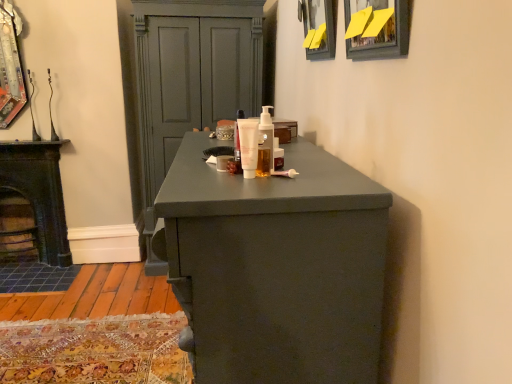
Question: Could you tell me if white matte tube at center, marked as the 2th mouthwash in a back-to-front arrangement, is facing matte black picture frame at upper center, arranged as the 2th picture frame when viewed from the front?

Choices:
 (A) no
 (B) yes

Answer: (A)

Question: From a real-world perspective, is white matte tube at center, the first mouthwash in the front-to-back sequence, physically below matte black picture frame at upper center, arranged as the 2th picture frame when viewed from the front?

Choices:
 (A) no
 (B) yes

Answer: (B)

Question: Is white matte tube at center, marked as the 2th mouthwash in a back-to-front arrangement, surrounding matte black picture frame at upper center, arranged as the 2th picture frame when viewed from the front?

Choices:
 (A) no
 (B) yes

Answer: (A)

Question: Is white matte tube at center, marked as the 2th mouthwash in a back-to-front arrangement, wider than matte black picture frame at upper center, which is the first picture frame from back to front?

Choices:
 (A) no
 (B) yes

Answer: (A)

Question: Considering the relative sizes of white matte tube at center, the first mouthwash in the front-to-back sequence, and matte black picture frame at upper center, which is the first picture frame from back to front, in the image provided, is white matte tube at center, the first mouthwash in the front-to-back sequence, smaller than matte black picture frame at upper center, which is the first picture frame from back to front,?

Choices:
 (A) no
 (B) yes

Answer: (B)

Question: From the image's perspective, is translucent plastic mouthwash at center, which ranks as the 1th mouthwash in back-to-front order, positioned above or below black cast iron stove at left?

Choices:
 (A) below
 (B) above

Answer: (B)

Question: Is translucent plastic mouthwash at center, which ranks as the 1th mouthwash in back-to-front order, wider or thinner than black cast iron stove at left?

Choices:
 (A) thin
 (B) wide

Answer: (A)

Question: Considering the positions of translucent plastic mouthwash at center, which ranks as the 1th mouthwash in back-to-front order, and black cast iron stove at left in the image, is translucent plastic mouthwash at center, which ranks as the 1th mouthwash in back-to-front order, taller or shorter than black cast iron stove at left?

Choices:
 (A) tall
 (B) short

Answer: (B)

Question: In terms of size, does translucent plastic mouthwash at center, which ranks as the 1th mouthwash in back-to-front order, appear bigger or smaller than black cast iron stove at left?

Choices:
 (A) small
 (B) big

Answer: (A)

Question: Is matte gray cupboard at center taller or shorter than translucent plastic mouthwash at center, which is the 2th mouthwash from front to back?

Choices:
 (A) short
 (B) tall

Answer: (B)

Question: Do you think matte gray cupboard at center is within translucent plastic mouthwash at center, which is the 2th mouthwash from front to back, or outside of it?

Choices:
 (A) outside
 (B) inside

Answer: (A)

Question: From the image's perspective, is matte gray cupboard at center located above or below translucent plastic mouthwash at center, which is the 2th mouthwash from front to back?

Choices:
 (A) below
 (B) above

Answer: (B)

Question: In the image, is matte gray cupboard at center on the left side or the right side of translucent plastic mouthwash at center, which is the 2th mouthwash from front to back?

Choices:
 (A) right
 (B) left

Answer: (B)

Question: Would you say black cast iron stove at left is to the left or to the right of white matte tube at center in the picture?

Choices:
 (A) right
 (B) left

Answer: (B)

Question: Do you think black cast iron stove at left is within white matte tube at center, or outside of it?

Choices:
 (A) inside
 (B) outside

Answer: (B)